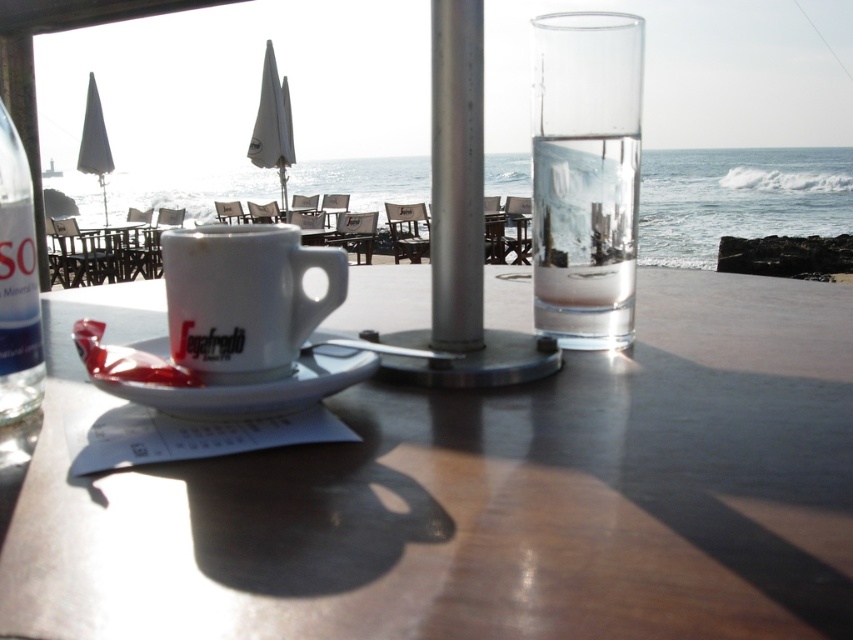
You are a customer at the seaside cafe and want to place your clear glass bottle at left onto the matte white table at center. Is the bottle currently positioned above or below the table?

The matte white table at center is below the clear glass bottle at left, so the bottle is currently positioned above the table.

You are standing at the point labeled point (91,378) in the image. You want to walk to the point labeled point (573,285). Which direction should you move relative to the current position?

You should move backward to reach point (573,285) because it is behind point (91,378).